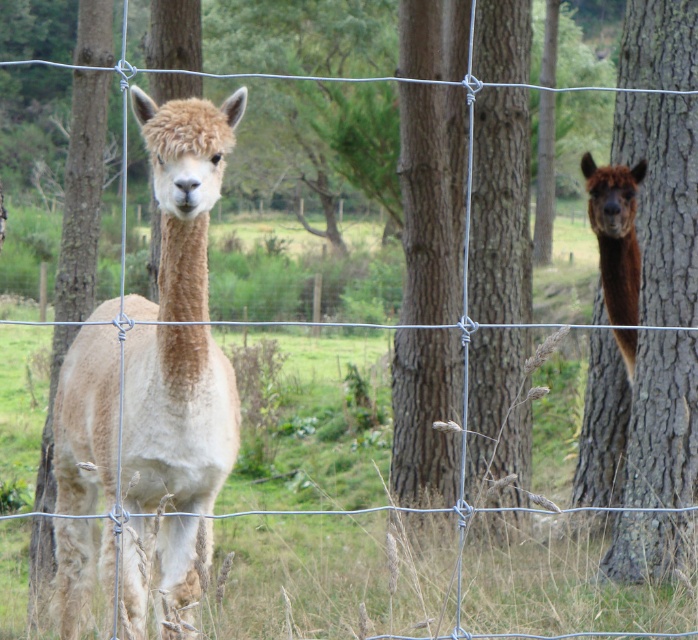
Question: Is brown rough bark tree at right bigger than brown woolly alpaca at right?

Choices:
 (A) yes
 (B) no

Answer: (A)

Question: Which of the following is the farthest from the observer?

Choices:
 (A) light brown woolen alpaca at center
 (B) brown woolly alpaca at right
 (C) brown rough bark tree at right

Answer: (B)

Question: Can you confirm if brown rough bark tree at right is bigger than brown woolly alpaca at right?

Choices:
 (A) no
 (B) yes

Answer: (B)

Question: Which object is closer to the camera taking this photo?

Choices:
 (A) brown woolly alpaca at right
 (B) light brown woolen alpaca at center
 (C) brown rough bark tree at right

Answer: (B)

Question: Considering the relative positions of light brown woolen alpaca at center and brown rough bark tree at right in the image provided, where is light brown woolen alpaca at center located with respect to brown rough bark tree at right?

Choices:
 (A) below
 (B) above

Answer: (A)

Question: Which object is positioned closest to the brown woolly alpaca at right?

Choices:
 (A) brown rough bark tree at right
 (B) light brown woolen alpaca at center

Answer: (A)